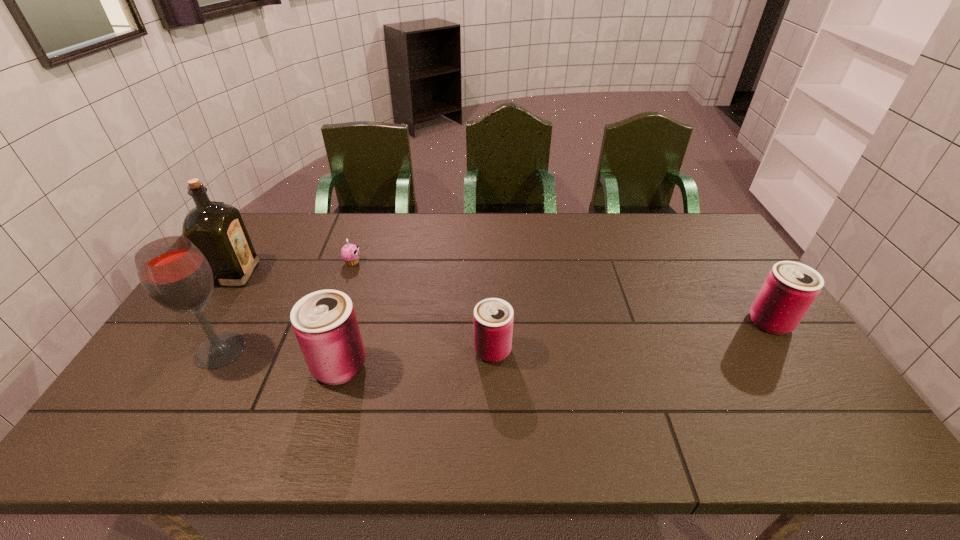
This screenshot has height=540, width=960. In order to click on the fifth closest object to the fifth object from left to right in this screenshot , I will do `click(217, 229)`.

Identify which object is the fifth closest to the shortest can. Please provide its 2D coordinates. Your answer should be formatted as a tuple, i.e. [(x, y)], where the tuple contains the x and y coordinates of a point satisfying the conditions above.

[(217, 229)]

Locate which can is the third closest to the alcohol. Please provide its 2D coordinates. Your answer should be formatted as a tuple, i.e. [(x, y)], where the tuple contains the x and y coordinates of a point satisfying the conditions above.

[(790, 288)]

This screenshot has height=540, width=960. In order to click on can that is the closest to the leftmost can in this screenshot , I will do `click(493, 318)`.

Where is `vacant position in the image that satisfies the following two spatial constraints: 1. on the label of the liquor; 2. on the back side of the leftmost can`? vacant position in the image that satisfies the following two spatial constraints: 1. on the label of the liquor; 2. on the back side of the leftmost can is located at coordinates (177, 366).

Locate an element on the screen. vacant space that satisfies the following two spatial constraints: 1. on the label of the leftmost can; 2. on the right side of the liquor is located at coordinates (177, 366).

Locate an element on the screen. free space that satisfies the following two spatial constraints: 1. on the front side of the second can from left to right; 2. on the left side of the alcohol is located at coordinates (220, 350).

Where is `free space that satisfies the following two spatial constraints: 1. on the back side of the fourth tallest object; 2. on the right side of the alcohol`? free space that satisfies the following two spatial constraints: 1. on the back side of the fourth tallest object; 2. on the right side of the alcohol is located at coordinates (236, 322).

Locate an element on the screen. The height and width of the screenshot is (540, 960). free region that satisfies the following two spatial constraints: 1. on the face of the fifth tallest object; 2. on the right side of the shortest object is located at coordinates (322, 350).

Where is `free spot that satisfies the following two spatial constraints: 1. on the face of the cupcake; 2. on the back side of the rightmost can`? Image resolution: width=960 pixels, height=540 pixels. free spot that satisfies the following two spatial constraints: 1. on the face of the cupcake; 2. on the back side of the rightmost can is located at coordinates (331, 322).